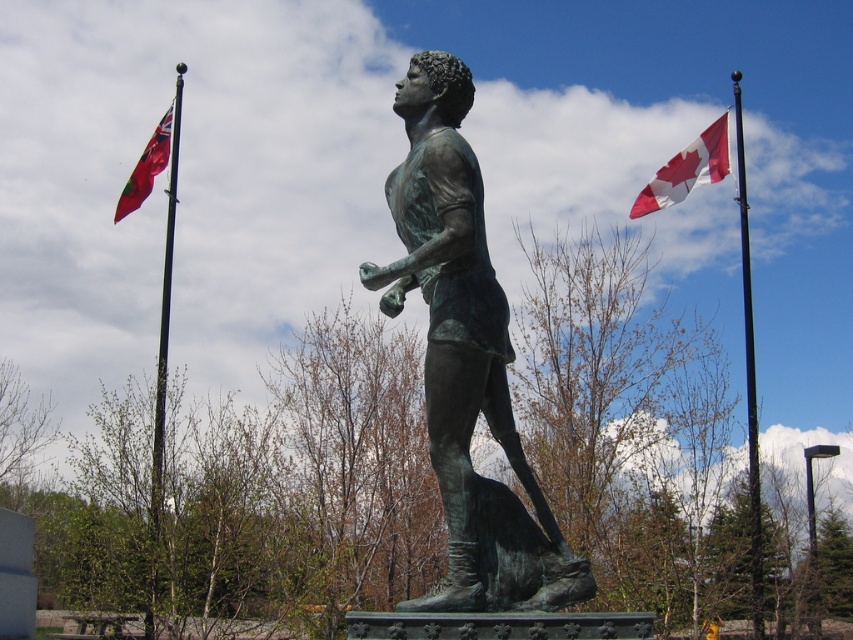
Question: Which point is farther to the camera?

Choices:
 (A) (160, 140)
 (B) (744, 296)

Answer: (B)

Question: Can you confirm if polished metal flagpole at left is positioned to the right of black metal pole at upper right?

Choices:
 (A) no
 (B) yes

Answer: (A)

Question: Which object appears closest to the camera in this image?

Choices:
 (A) polished metal flagpole at left
 (B) red fabric flag at left
 (C) bronze statue at center
 (D) black metal pole at upper right

Answer: (C)

Question: Is bronze statue at center bigger than black metal pole at upper right?

Choices:
 (A) no
 (B) yes

Answer: (A)

Question: Is bronze statue at center wider than polished metal flagpole at left?

Choices:
 (A) no
 (B) yes

Answer: (A)

Question: Which point is farther from the camera taking this photo?

Choices:
 (A) (167, 262)
 (B) (169, 134)
 (C) (457, 221)

Answer: (B)